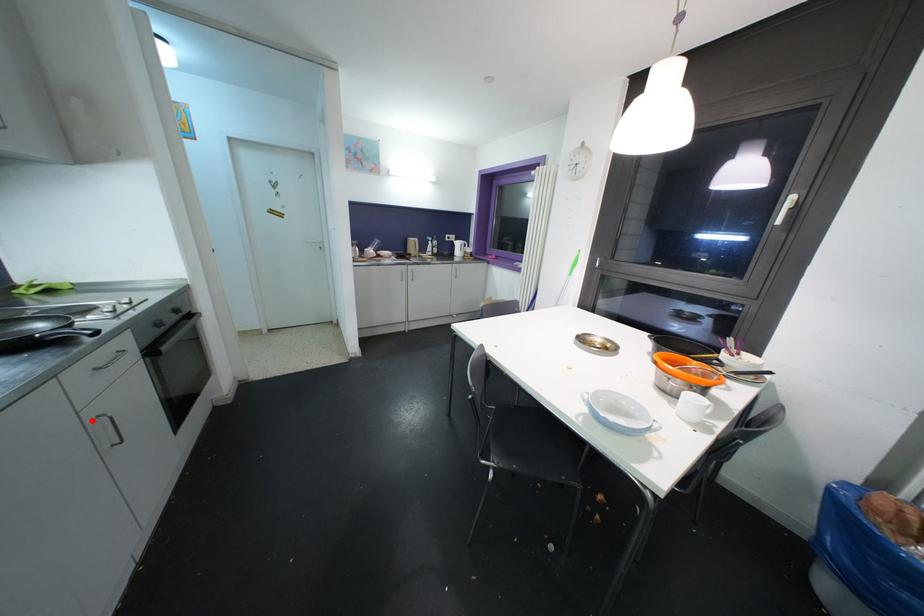
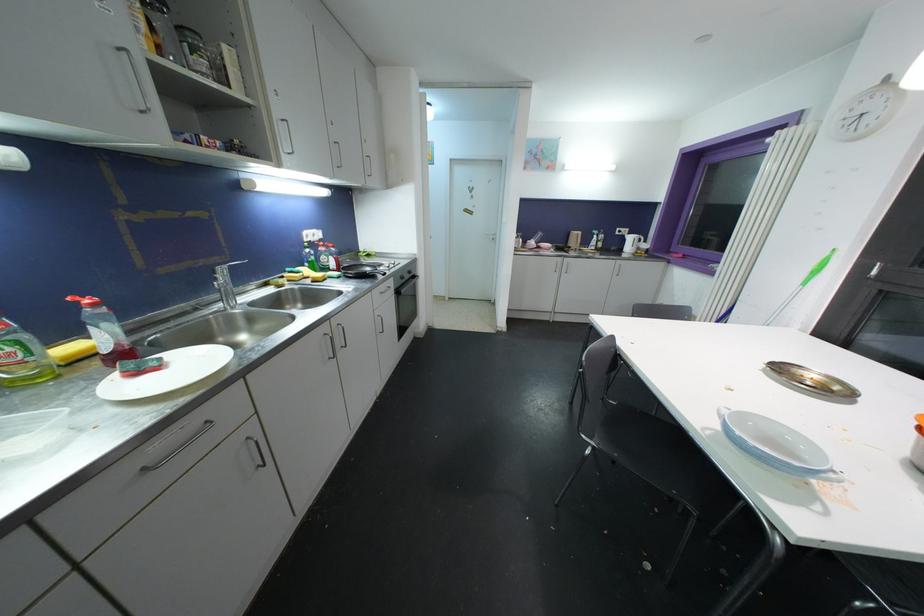
Question: I am providing you with two images of the same scene from different viewpoints. Image1 has a red point marked. In image2, the corresponding 3D location appears at what relative position? Reply with the corresponding letter.

Choices:
 (A) Closer
 (B) Farther

Answer: (A)